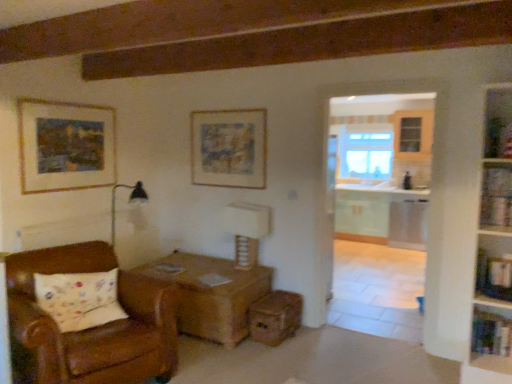
Identify the location of free space in front of wooden drawer at lower center. The height and width of the screenshot is (384, 512). (281, 357).